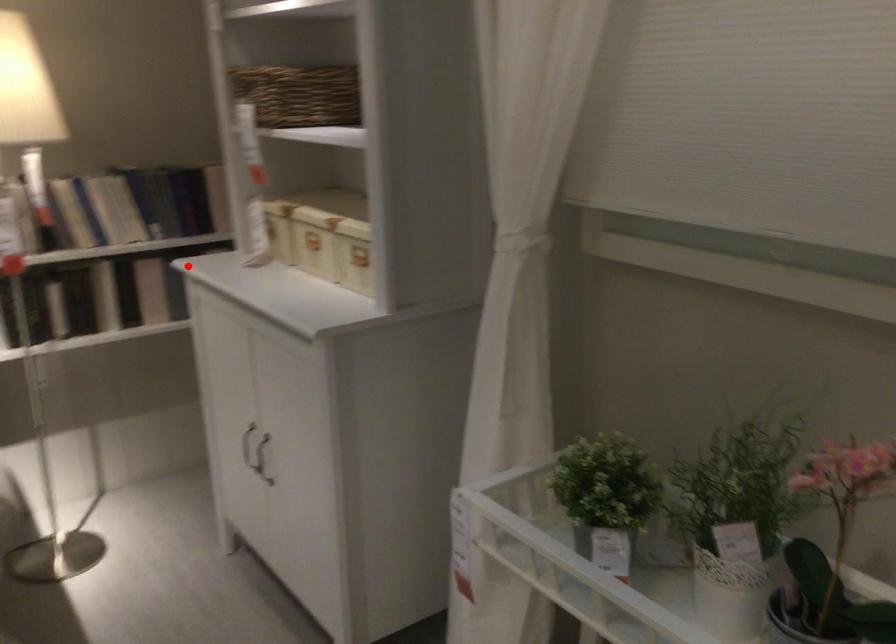
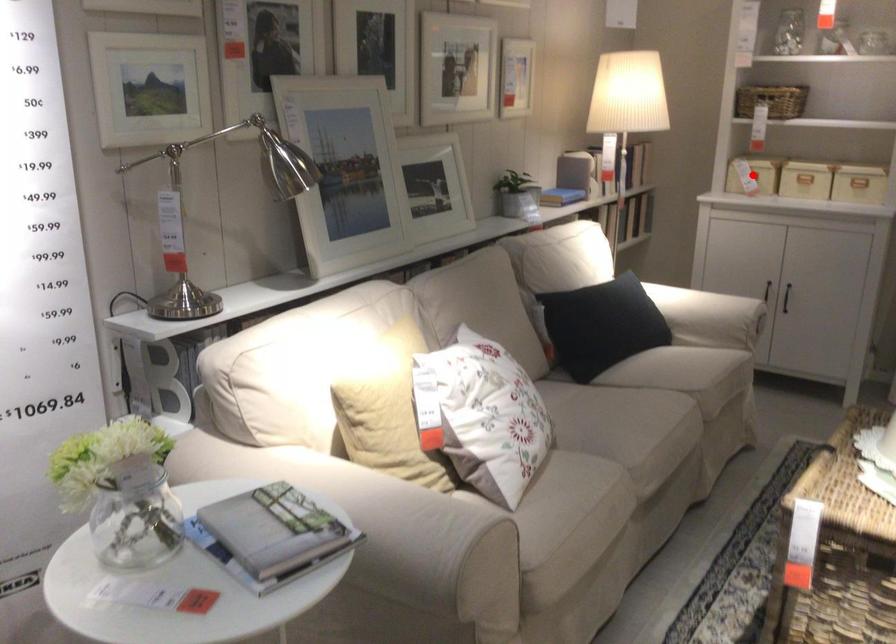
I am providing you with two images of the same scene from different viewpoints. A red point is marked on the first image and another point is marked on the second image. Is the marked point in image1 the same physical position as the marked point in image2?

Yes